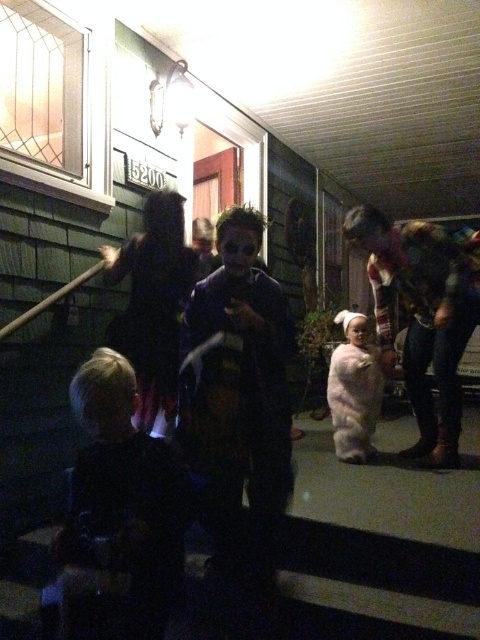
Does dark blue shirt at lower left have a lesser width compared to black velvet dress at center?

Indeed, dark blue shirt at lower left has a lesser width compared to black velvet dress at center.

Can you confirm if dark blue shirt at lower left is wider than black velvet dress at center?

In fact, dark blue shirt at lower left might be narrower than black velvet dress at center.

This screenshot has height=640, width=480. Describe the element at coordinates (120, 502) in the screenshot. I see `dark blue shirt at lower left` at that location.

Find the location of a particular element. dark blue shirt at lower left is located at coordinates (120, 502).

Is black velvet dress at center above fuzzy white bear at center?

Yes, black velvet dress at center is above fuzzy white bear at center.

Between black velvet dress at center and fuzzy white bear at center, which one has more height?

A: black velvet dress at center

Measure the distance between black velvet dress at center and camera.

The distance of black velvet dress at center from camera is 8.31 feet.

Where is `black velvet dress at center`? The image size is (480, 640). black velvet dress at center is located at coordinates (152, 320).

Is flannel shirt at right taller than black velvet dress at center?

Yes.

Which is below, flannel shirt at right or black velvet dress at center?

black velvet dress at center

The width and height of the screenshot is (480, 640). Find the location of `flannel shirt at right`. flannel shirt at right is located at coordinates click(x=420, y=317).

Identify the location of flannel shirt at right. 420,317.